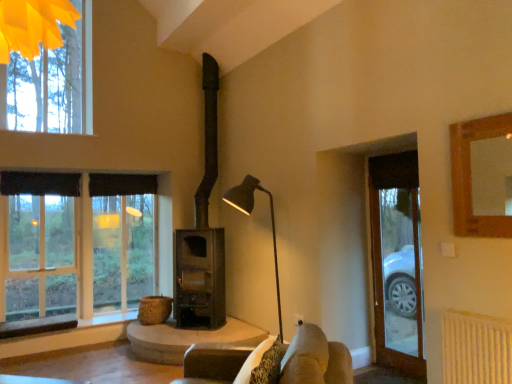
Measure the distance between black metal floor lamp at center and camera.

They are 3.87 meters apart.

Describe the element at coordinates (202, 234) in the screenshot. I see `matte black fireplace at center` at that location.

Where is `clear glass door at right`? clear glass door at right is located at coordinates (397, 262).

Identify the location of black metal floor lamp at center. (249, 214).

Is matte glass window at left further to camera compared to smooth stone table at center?

Yes, it is.

How much distance is there between matte glass window at left and smooth stone table at center?

matte glass window at left is 1.36 meters away from smooth stone table at center.

Is matte glass window at left smaller than smooth stone table at center?

Actually, matte glass window at left might be larger than smooth stone table at center.

What's the angular difference between matte glass window at left and smooth stone table at center's facing directions?

The facing directions of matte glass window at left and smooth stone table at center are 1.23 degrees apart.

From a real-world perspective, which object stands above the other?

matte glass window at left, from a real-world perspective.

Is matte glass window at left positioned far away from black metal floor lamp at center?

Yes.

Measure the distance from matte glass window at left to black metal floor lamp at center.

The distance of matte glass window at left from black metal floor lamp at center is 2.06 meters.

Between matte glass window at left and black metal floor lamp at center, which one has larger size?

matte glass window at left is bigger.

Does point (371, 201) lie behind point (84, 259)?

That is False.

In the scene shown: From the image's perspective, between clear glass door at right and matte glass window at left, which one is located above?

clear glass door at right appears higher in the image.

Between smooth stone table at center and matte black fireplace at center, which one has smaller width?

matte black fireplace at center is thinner.

Does smooth stone table at center have a smaller size compared to matte black fireplace at center?

Yes.

Looking at this image, how many degrees apart are the facing directions of smooth stone table at center and matte black fireplace at center?

The facing directions of smooth stone table at center and matte black fireplace at center are 1.68 degrees apart.

Can you confirm if smooth stone table at center is positioned to the left of matte black fireplace at center?

Yes.

Is the position of black metal floor lamp at center more distant than that of matte black fireplace at center?

No, black metal floor lamp at center is closer to the viewer.

Is black metal floor lamp at center at the left side of matte black fireplace at center?

→ No.

From the image's perspective, between black metal floor lamp at center and matte black fireplace at center, which one is located above?

matte black fireplace at center appears higher in the image.

How much distance is there between black metal floor lamp at center and matte black fireplace at center?

black metal floor lamp at center and matte black fireplace at center are 82.57 centimeters apart from each other.

Can you confirm if clear glass door at right is positioned to the left of black metal floor lamp at center?

Incorrect, clear glass door at right is not on the left side of black metal floor lamp at center.

Does clear glass door at right have a larger size compared to black metal floor lamp at center?

Incorrect, clear glass door at right is not larger than black metal floor lamp at center.

Is clear glass door at right wider than black metal floor lamp at center?

In fact, clear glass door at right might be narrower than black metal floor lamp at center.

How different are the orientations of black metal floor lamp at center and matte glass window at left in degrees?

There is a 87.9-degree angle between the facing directions of black metal floor lamp at center and matte glass window at left.

Where is `table lamp above the matte glass window at left (from the image's perspective)`? The height and width of the screenshot is (384, 512). table lamp above the matte glass window at left (from the image's perspective) is located at coordinates (249, 214).

From a real-world perspective, who is located lower, black metal floor lamp at center or matte glass window at left?

In real-world perspective, black metal floor lamp at center is lower.

Visually, is black metal floor lamp at center positioned to the left or to the right of matte glass window at left?

black metal floor lamp at center is positioned on matte glass window at left's right side.

The height and width of the screenshot is (384, 512). Find the location of `table below the matte glass window at left (from the image's perspective)`. table below the matte glass window at left (from the image's perspective) is located at coordinates (186, 339).

This screenshot has height=384, width=512. What are the coordinates of `window on the left of the black metal floor lamp at center` in the screenshot? It's located at (83, 248).

When comparing their distances from matte glass window at left, does clear glass door at right or matte black fireplace at center seem closer?

matte black fireplace at center lies closer to matte glass window at left than the other object.

Which object lies further to the anchor point matte glass window at left, matte black fireplace at center or smooth stone table at center?

smooth stone table at center is positioned further to the anchor matte glass window at left.

Which object lies nearer to the anchor point black metal floor lamp at center, clear glass door at right or matte black fireplace at center?

Among the two, matte black fireplace at center is located nearer to black metal floor lamp at center.

Which object lies further to the anchor point smooth stone table at center, matte glass window at left or clear glass door at right?

The object further to smooth stone table at center is clear glass door at right.

Which object lies nearer to the anchor point matte black fireplace at center, matte glass window at left or smooth stone table at center?

smooth stone table at center lies closer to matte black fireplace at center than the other object.

From the image, which object appears to be nearer to black metal floor lamp at center, matte black fireplace at center or smooth stone table at center?

Among the two, matte black fireplace at center is located nearer to black metal floor lamp at center.

Looking at the image, which one is located closer to matte glass window at left, matte black fireplace at center or clear glass door at right?

The object closer to matte glass window at left is matte black fireplace at center.

Looking at the image, which one is located further to matte black fireplace at center, black metal floor lamp at center or matte glass window at left?

matte glass window at left is further to matte black fireplace at center.

The width and height of the screenshot is (512, 384). In order to click on table between matte glass window at left and black metal floor lamp at center in this screenshot , I will do tap(186, 339).

Where is `fireplace located between matte glass window at left and clear glass door at right in the left-right direction`? The width and height of the screenshot is (512, 384). fireplace located between matte glass window at left and clear glass door at right in the left-right direction is located at coordinates (202, 234).

The height and width of the screenshot is (384, 512). What are the coordinates of `table lamp between matte black fireplace at center and smooth stone table at center from top to bottom` in the screenshot? It's located at (249, 214).

You are a GUI agent. You are given a task and a screenshot of the screen. Output one action in this format:
    pyautogui.click(x=<x>, y=<y>)
    Task: Click on the table lamp between matte glass window at left and clear glass door at right
    The width and height of the screenshot is (512, 384).
    Given the screenshot: What is the action you would take?
    pyautogui.click(x=249, y=214)